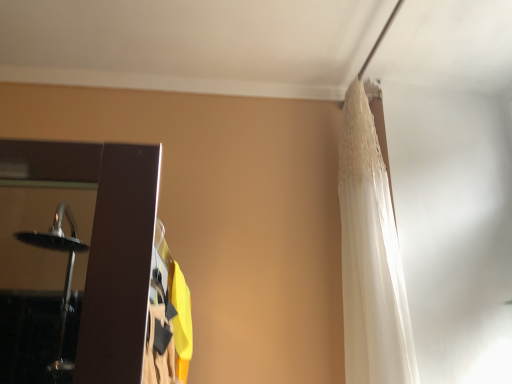
The height and width of the screenshot is (384, 512). What do you see at coordinates (370, 256) in the screenshot?
I see `white lace curtain at upper right, the 1th curtain from the right` at bounding box center [370, 256].

This screenshot has width=512, height=384. I want to click on white lace curtain at upper right, the second curtain positioned from the left, so click(370, 256).

Measure the distance between point (187, 297) and camera.

Point (187, 297) is 4.91 feet from camera.

Identify the location of white lace curtain at upper right, which is the 2th curtain in right-to-left order. The width and height of the screenshot is (512, 384). (181, 322).

The image size is (512, 384). What do you see at coordinates (181, 322) in the screenshot?
I see `white lace curtain at upper right, which is the 2th curtain in right-to-left order` at bounding box center [181, 322].

I want to click on white lace curtain at upper right, the 1th curtain from the right, so click(x=370, y=256).

Is white lace curtain at upper right, which is the 2th curtain in right-to-left order, at the right side of white lace curtain at upper right, the second curtain positioned from the left?

No.

Is the position of white lace curtain at upper right, which is the first curtain from left to right, more distant than that of white lace curtain at upper right, the 1th curtain from the right?

No, white lace curtain at upper right, which is the first curtain from left to right, is closer to the camera.

Considering the positions of points (174, 306) and (351, 140), is point (174, 306) farther from camera compared to point (351, 140)?

No, it is not.

From the image's perspective, is white lace curtain at upper right, which is the first curtain from left to right, positioned above or below white lace curtain at upper right, the second curtain positioned from the left?

From the image's perspective, white lace curtain at upper right, which is the first curtain from left to right, appears below white lace curtain at upper right, the second curtain positioned from the left.

From a real-world perspective, between white lace curtain at upper right, which is the first curtain from left to right, and white lace curtain at upper right, the second curtain positioned from the left, who is vertically lower?

white lace curtain at upper right, which is the first curtain from left to right, from a real-world perspective.

Can you confirm if white lace curtain at upper right, which is the 2th curtain in right-to-left order, is thinner than white lace curtain at upper right, the 1th curtain from the right?

No, white lace curtain at upper right, which is the 2th curtain in right-to-left order, is not thinner than white lace curtain at upper right, the 1th curtain from the right.

Is white lace curtain at upper right, which is the 2th curtain in right-to-left order, shorter than white lace curtain at upper right, the second curtain positioned from the left?

Yes.

Between white lace curtain at upper right, which is the 2th curtain in right-to-left order, and white lace curtain at upper right, the second curtain positioned from the left, which one has larger size?

white lace curtain at upper right, the second curtain positioned from the left, is bigger.

Based on the photo, choose the correct answer: Is white lace curtain at upper right, which is the 2th curtain in right-to-left order, inside white lace curtain at upper right, the second curtain positioned from the left, or outside it?

white lace curtain at upper right, which is the 2th curtain in right-to-left order, is outside white lace curtain at upper right, the second curtain positioned from the left.

Is white lace curtain at upper right, which is the 2th curtain in right-to-left order, positioned with its back to white lace curtain at upper right, the second curtain positioned from the left?

That's not correct — white lace curtain at upper right, which is the 2th curtain in right-to-left order, is not looking away from white lace curtain at upper right, the second curtain positioned from the left.

Image resolution: width=512 pixels, height=384 pixels. I want to click on curtain above the white lace curtain at upper right, which is the 2th curtain in right-to-left order (from a real-world perspective), so click(370, 256).

Considering the positions of objects white lace curtain at upper right, the 1th curtain from the right, and white lace curtain at upper right, which is the 2th curtain in right-to-left order, in the image provided, who is more to the right, white lace curtain at upper right, the 1th curtain from the right, or white lace curtain at upper right, which is the 2th curtain in right-to-left order,?

From the viewer's perspective, white lace curtain at upper right, the 1th curtain from the right, appears more on the right side.

Consider the image. Is white lace curtain at upper right, the second curtain positioned from the left, further to the viewer compared to white lace curtain at upper right, which is the 2th curtain in right-to-left order?

Yes, white lace curtain at upper right, the second curtain positioned from the left, is behind white lace curtain at upper right, which is the 2th curtain in right-to-left order.

Which is in front, point (346, 231) or point (192, 344)?

The point (192, 344) is closer.

From the image's perspective, does white lace curtain at upper right, the second curtain positioned from the left, appear lower than white lace curtain at upper right, which is the 2th curtain in right-to-left order?

No, from the image's perspective, white lace curtain at upper right, the second curtain positioned from the left, is not beneath white lace curtain at upper right, which is the 2th curtain in right-to-left order.

Based on the photo, from a real-world perspective, who is located lower, white lace curtain at upper right, the second curtain positioned from the left, or white lace curtain at upper right, which is the 2th curtain in right-to-left order?

In real-world perspective, white lace curtain at upper right, which is the 2th curtain in right-to-left order, is lower.

Looking at this image, is white lace curtain at upper right, the 1th curtain from the right, thinner than white lace curtain at upper right, which is the 2th curtain in right-to-left order?

Correct, the width of white lace curtain at upper right, the 1th curtain from the right, is less than that of white lace curtain at upper right, which is the 2th curtain in right-to-left order.

Between white lace curtain at upper right, the 1th curtain from the right, and white lace curtain at upper right, which is the 2th curtain in right-to-left order, which one has less height?

white lace curtain at upper right, which is the 2th curtain in right-to-left order, is shorter.

Is white lace curtain at upper right, the second curtain positioned from the left, bigger than white lace curtain at upper right, which is the first curtain from left to right?

Correct, white lace curtain at upper right, the second curtain positioned from the left, is larger in size than white lace curtain at upper right, which is the first curtain from left to right.

Would you say white lace curtain at upper right, which is the 2th curtain in right-to-left order, is part of white lace curtain at upper right, the 1th curtain from the right,'s contents?

Actually, white lace curtain at upper right, which is the 2th curtain in right-to-left order, is outside white lace curtain at upper right, the 1th curtain from the right.

Is white lace curtain at upper right, the second curtain positioned from the left, not close to white lace curtain at upper right, which is the 2th curtain in right-to-left order?

No, white lace curtain at upper right, the second curtain positioned from the left, is not far from white lace curtain at upper right, which is the 2th curtain in right-to-left order.

Is white lace curtain at upper right, the 1th curtain from the right, oriented towards white lace curtain at upper right, which is the first curtain from left to right?

Yes, white lace curtain at upper right, the 1th curtain from the right, is aimed at white lace curtain at upper right, which is the first curtain from left to right.

In the scene shown: What's the angular difference between white lace curtain at upper right, the second curtain positioned from the left, and white lace curtain at upper right, which is the 2th curtain in right-to-left order,'s facing directions?

86.8 degrees separate the facing orientations of white lace curtain at upper right, the second curtain positioned from the left, and white lace curtain at upper right, which is the 2th curtain in right-to-left order.

How distant is white lace curtain at upper right, the 1th curtain from the right, from white lace curtain at upper right, which is the first curtain from left to right?

A distance of 25.46 inches exists between white lace curtain at upper right, the 1th curtain from the right, and white lace curtain at upper right, which is the first curtain from left to right.

You are a GUI agent. You are given a task and a screenshot of the screen. Output one action in this format:
    pyautogui.click(x=<x>, y=<y>)
    Task: Click on the curtain above the white lace curtain at upper right, which is the 2th curtain in right-to-left order (from the image's perspective)
    This screenshot has width=512, height=384.
    Given the screenshot: What is the action you would take?
    pos(370,256)

You are a GUI agent. You are given a task and a screenshot of the screen. Output one action in this format:
    pyautogui.click(x=<x>, y=<y>)
    Task: Click on the curtain on the left of white lace curtain at upper right, the second curtain positioned from the left
    The height and width of the screenshot is (384, 512).
    Given the screenshot: What is the action you would take?
    pyautogui.click(x=181, y=322)

Image resolution: width=512 pixels, height=384 pixels. What are the coordinates of `curtain to the right of white lace curtain at upper right, which is the first curtain from left to right` in the screenshot? It's located at (370, 256).